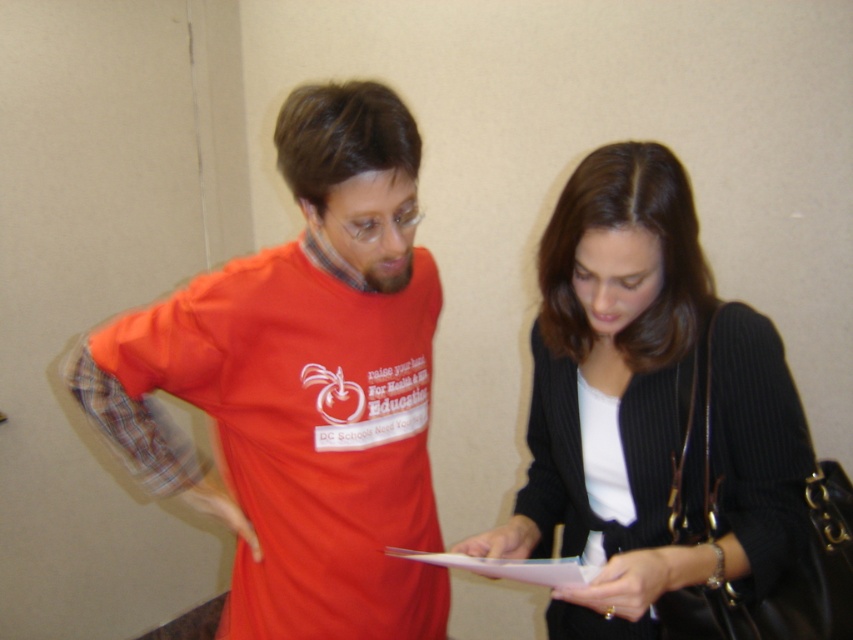
In the scene shown: Is matte red t-shirt at center positioned behind black ribbed sweater at center?

No, it is in front of black ribbed sweater at center.

Is matte red t-shirt at center to the left of black ribbed sweater at center from the viewer's perspective?

Correct, you'll find matte red t-shirt at center to the left of black ribbed sweater at center.

Is point (187, 314) positioned behind point (490, 548)?

No, it is not.

Locate an element on the screen. This screenshot has height=640, width=853. matte red t-shirt at center is located at coordinates tap(305, 385).